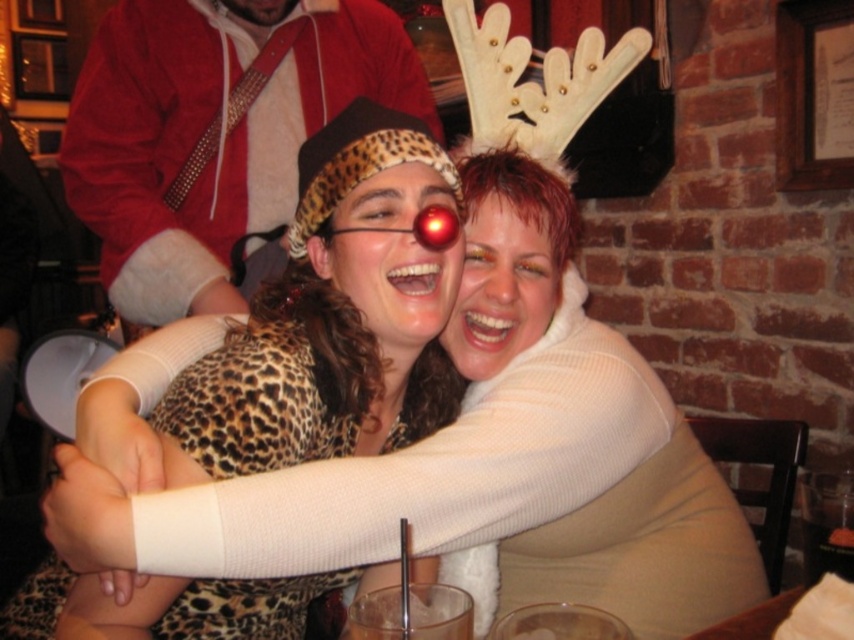
You are a photographer at the event and want to capture a photo where both the red velvet santa hat at upper left and the leopard print sweater at center are visible. Which object should be placed closer to the camera to ensure both fit in the frame?

The leopard print sweater at center should be placed closer to the camera because the red velvet santa hat at upper left is wider. By moving the narrower leopard print sweater at center forward, both objects can fit within the frame more effectively.

You are taking a photo of two points in the scene. The first point is at coordinate point [215,113] and the second point is at coordinate point [349,307]. Which point is closer to the camera?

Point [215,113] is closer to the camera than point [349,307] because it is further to the camera than the other point.